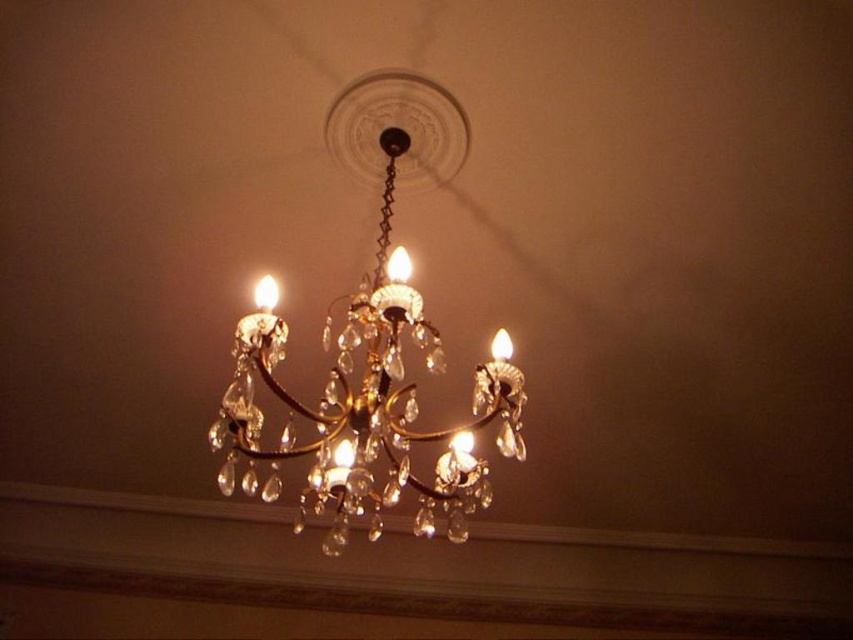
Question: Which of the following is the closest to the observer?

Choices:
 (A) (268, 310)
 (B) (418, 307)

Answer: (A)

Question: Is gold metallic chandelier at center to the right of matte gold chandelier at center from the viewer's perspective?

Choices:
 (A) yes
 (B) no

Answer: (A)

Question: Does gold metallic chandelier at center appear over matte gold chandelier at center?

Choices:
 (A) yes
 (B) no

Answer: (B)

Question: Considering the relative positions of gold metallic chandelier at center and matte gold chandelier at center in the image provided, where is gold metallic chandelier at center located with respect to matte gold chandelier at center?

Choices:
 (A) left
 (B) right

Answer: (B)

Question: Which object appears farthest from the camera in this image?

Choices:
 (A) matte gold chandelier at center
 (B) gold metallic chandelier at center

Answer: (A)

Question: Which point is farther to the camera?

Choices:
 (A) (252, 298)
 (B) (379, 403)

Answer: (A)